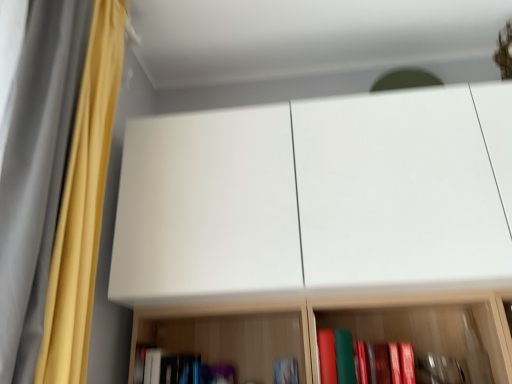
Question: From the image's perspective, is yellow fabric curtain at left, positioned as the 1th curtain in back-to-front order, under silky yellow curtain at left, which is the 2th curtain from back to front?

Choices:
 (A) no
 (B) yes

Answer: (A)

Question: Would you say yellow fabric curtain at left, positioned as the 1th curtain in back-to-front order, contains silky yellow curtain at left, positioned as the 1th curtain in front-to-back order?

Choices:
 (A) no
 (B) yes

Answer: (A)

Question: Does yellow fabric curtain at left, which is the 2th curtain in front-to-back order, appear on the right side of silky yellow curtain at left, positioned as the 1th curtain in front-to-back order?

Choices:
 (A) no
 (B) yes

Answer: (A)

Question: From a real-world perspective, is yellow fabric curtain at left, positioned as the 1th curtain in back-to-front order, under silky yellow curtain at left, which is the 2th curtain from back to front?

Choices:
 (A) yes
 (B) no

Answer: (B)

Question: Is yellow fabric curtain at left, which is the 2th curtain in front-to-back order, oriented towards silky yellow curtain at left, positioned as the 1th curtain in front-to-back order?

Choices:
 (A) yes
 (B) no

Answer: (B)

Question: Considering the relative sizes of yellow fabric curtain at left, positioned as the 1th curtain in back-to-front order, and silky yellow curtain at left, positioned as the 1th curtain in front-to-back order, in the image provided, is yellow fabric curtain at left, positioned as the 1th curtain in back-to-front order, smaller than silky yellow curtain at left, positioned as the 1th curtain in front-to-back order,?

Choices:
 (A) no
 (B) yes

Answer: (A)

Question: Considering the relative sizes of hardcover book at lower center, acting as the second book starting from the right, and silky yellow curtain at left, which is the 2th curtain from back to front, in the image provided, is hardcover book at lower center, acting as the second book starting from the right, shorter than silky yellow curtain at left, which is the 2th curtain from back to front,?

Choices:
 (A) yes
 (B) no

Answer: (A)

Question: Does hardcover book at lower center, arranged as the first book when viewed from the left, have a greater height compared to silky yellow curtain at left, positioned as the 1th curtain in front-to-back order?

Choices:
 (A) yes
 (B) no

Answer: (B)

Question: Could you tell me if hardcover book at lower center, arranged as the first book when viewed from the left, is facing silky yellow curtain at left, which is the 2th curtain from back to front?

Choices:
 (A) no
 (B) yes

Answer: (B)

Question: Is hardcover book at lower center, acting as the second book starting from the right, outside of silky yellow curtain at left, which is the 2th curtain from back to front?

Choices:
 (A) no
 (B) yes

Answer: (B)

Question: Is hardcover book at lower center, arranged as the first book when viewed from the left, positioned far away from silky yellow curtain at left, which is the 2th curtain from back to front?

Choices:
 (A) yes
 (B) no

Answer: (B)

Question: Is hardcover book at lower center, arranged as the first book when viewed from the left, smaller than silky yellow curtain at left, positioned as the 1th curtain in front-to-back order?

Choices:
 (A) no
 (B) yes

Answer: (B)

Question: Is hardcover book at lower center, the first book from the right, oriented towards yellow fabric curtain at left, positioned as the 1th curtain in back-to-front order?

Choices:
 (A) yes
 (B) no

Answer: (B)